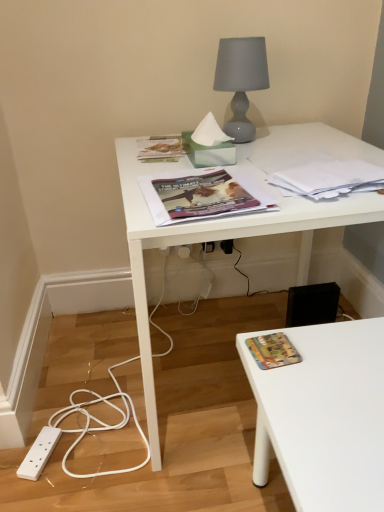
Find the location of a particular element. free space to the back side of white paper at upper right, placed as the first paperback book when sorted from bottom to top is located at coordinates (314, 150).